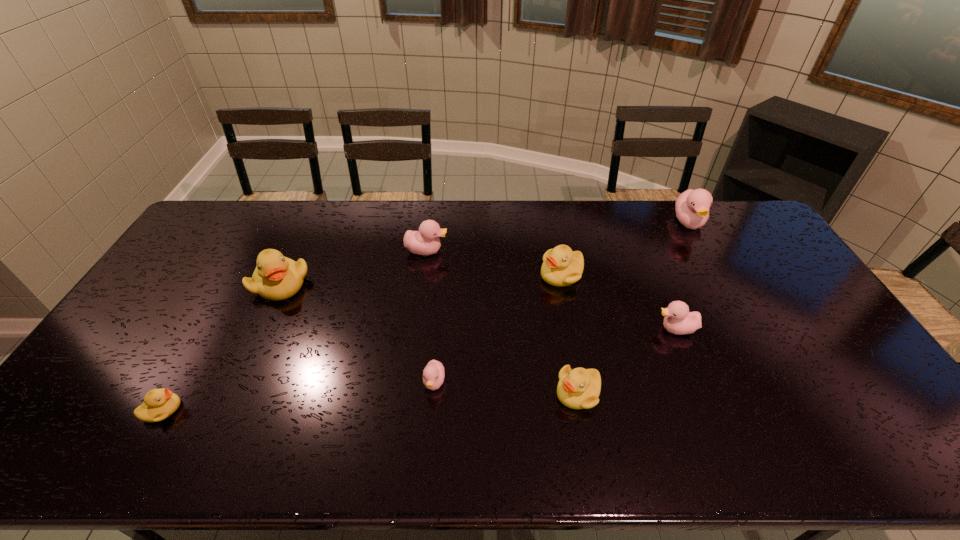
Where is `unoccupied position between the third smallest pink duckling and the fifth farthest duckling`? The image size is (960, 540). unoccupied position between the third smallest pink duckling and the fifth farthest duckling is located at coordinates (551, 290).

I want to click on free spot between the seventh duckling from right to left and the second biggest yellow duckling, so click(x=421, y=279).

Find the location of a particular element. free space between the third biggest yellow duckling and the second biggest yellow duckling is located at coordinates (569, 333).

Find the location of a particular element. The height and width of the screenshot is (540, 960). object that can be found as the sixth closest to the farthest object is located at coordinates (276, 277).

Identify which object is the fourth closest to the second farthest pink duckling. Please provide its 2D coordinates. Your answer should be formatted as a tuple, i.e. [(x, y)], where the tuple contains the x and y coordinates of a point satisfying the conditions above.

[(579, 388)]

Identify the location of duckling that is the sixth closest to the third smallest yellow duckling. The image size is (960, 540). (276, 277).

The height and width of the screenshot is (540, 960). Identify the location of duckling that is the seventh closest one to the third biggest yellow duckling. (159, 404).

Point out which pink duckling is positioned as the second nearest to the fifth farthest object. Please provide its 2D coordinates. Your answer should be formatted as a tuple, i.e. [(x, y)], where the tuple contains the x and y coordinates of a point satisfying the conditions above.

[(433, 375)]

The width and height of the screenshot is (960, 540). Find the location of `pink duckling that is the second closest to the seventh object from left to right`. pink duckling that is the second closest to the seventh object from left to right is located at coordinates (433, 375).

Where is `the third closest yellow duckling relative to the second biggest yellow duckling`? The height and width of the screenshot is (540, 960). the third closest yellow duckling relative to the second biggest yellow duckling is located at coordinates (159, 404).